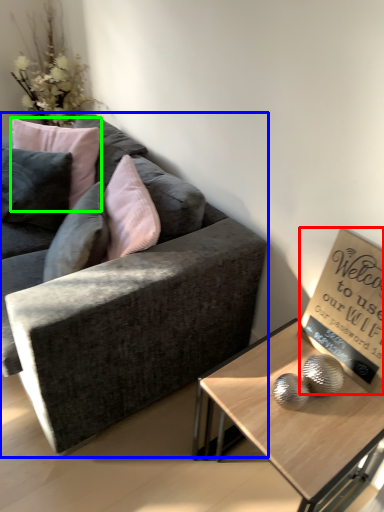
Question: Estimate the real-world distances between objects in this image. Which object is closer to bulletin board (highlighted by a red box), studio couch (highlighted by a blue box) or pillow (highlighted by a green box)?

Choices:
 (A) studio couch
 (B) pillow

Answer: (A)